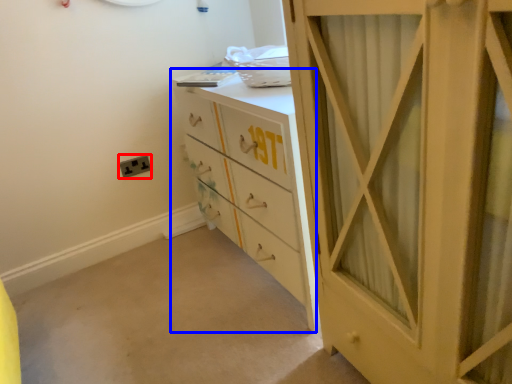
Question: Which object appears closest to the camera in this image, electric outlet (highlighted by a red box) or chest of drawers (highlighted by a blue box)?

Choices:
 (A) electric outlet
 (B) chest of drawers

Answer: (B)